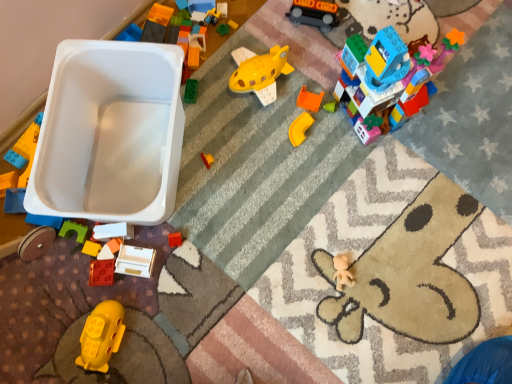
This screenshot has height=384, width=512. Find the location of `free space behind multicolored plastic building block at upper right, which is the eighth toy in left-to-right order`. free space behind multicolored plastic building block at upper right, which is the eighth toy in left-to-right order is located at coordinates (359, 30).